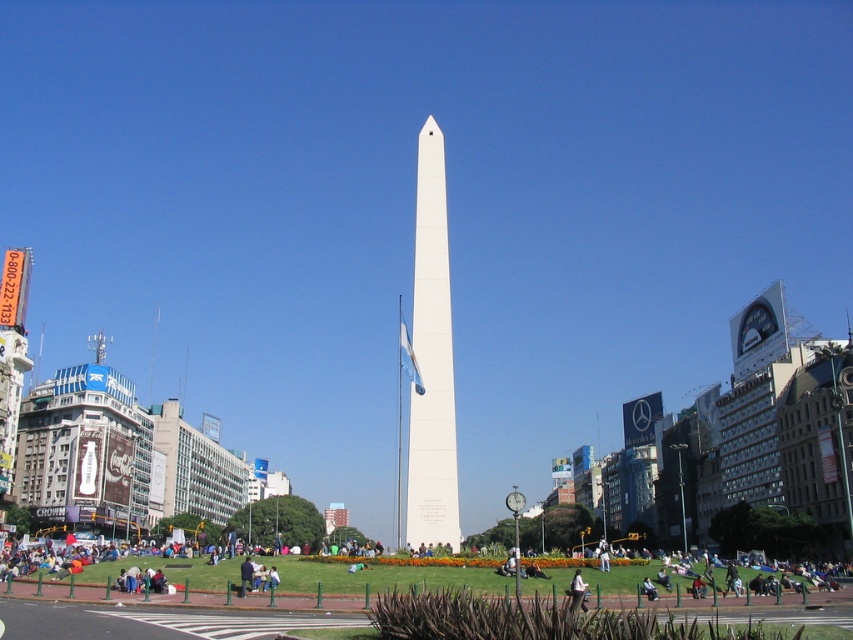
In the scene shown: You are planning to place a large picnic blanket on the green grass at lower center. Considering the size of the white polished stone obelisk at center, will there be enough space to spread the blanket without it overlapping with the obelisk?

The white polished stone obelisk at center has a lesser width compared to green grass at lower center, so there should be enough space to spread the picnic blanket without overlapping the obelisk.

You are standing on the green grass at lower center and want to take a photo of the white polished stone obelisk at center. In which direction should you move to get the best view of the obelisk?

Since the white polished stone obelisk at center is to the left of green grass at lower center, you should move to the left to position yourself for a better view of the obelisk.